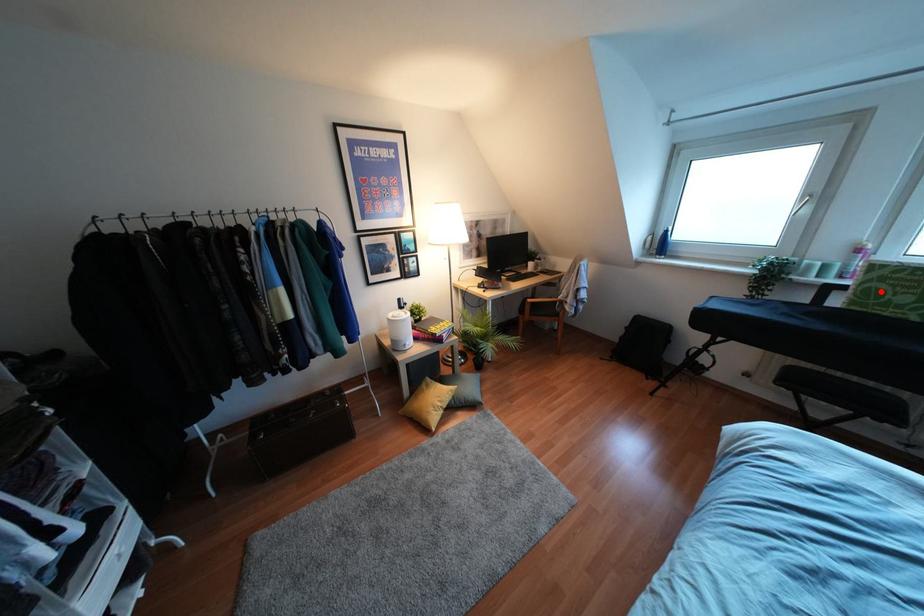
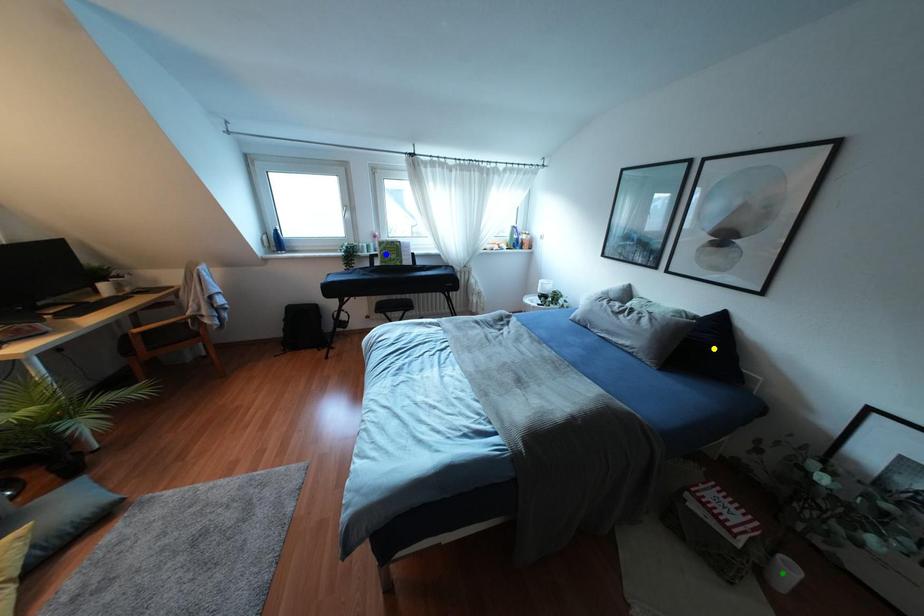
Question: I am providing you with two images of the same scene from different viewpoints. A red point is marked on the first image. You are given multiple points on the second image. In image 2, which mark is for the same physical point as the one in image 1?

Choices:
 (A) yellow point
 (B) blue point
 (C) green point

Answer: (B)